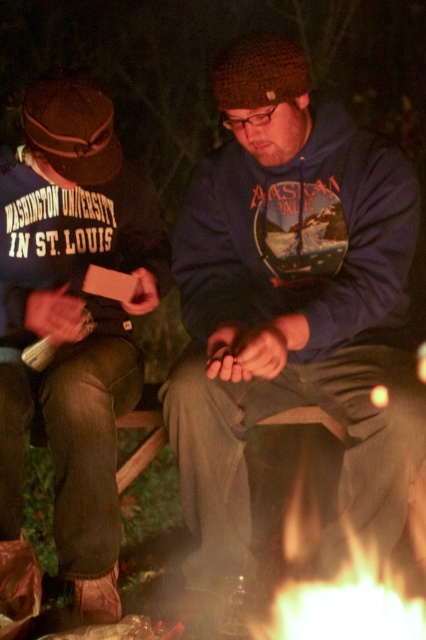
Question: Which point appears closest to the camera in this image?

Choices:
 (A) (344, 592)
 (B) (250, 276)
 (C) (17, 346)

Answer: (A)

Question: Does matte brown hat at left have a smaller size compared to flametransparentfire at lower center?

Choices:
 (A) yes
 (B) no

Answer: (B)

Question: Which object is farther from the camera taking this photo?

Choices:
 (A) blue fleece hoodie at center
 (B) matte brown hat at left

Answer: (B)

Question: Does blue fleece hoodie at center lie in front of flametransparentfire at lower center?

Choices:
 (A) yes
 (B) no

Answer: (B)

Question: Can you confirm if matte brown hat at left is positioned to the right of flametransparentfire at lower center?

Choices:
 (A) yes
 (B) no

Answer: (B)

Question: Which of the following is the farthest from the observer?

Choices:
 (A) flametransparentfire at lower center
 (B) matte brown hat at left
 (C) blue fleece hoodie at center

Answer: (B)